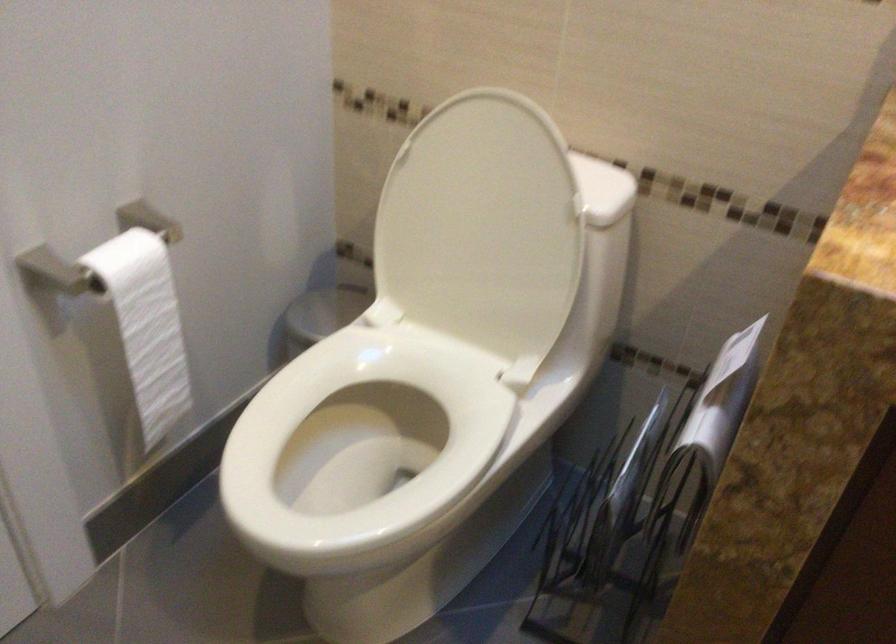
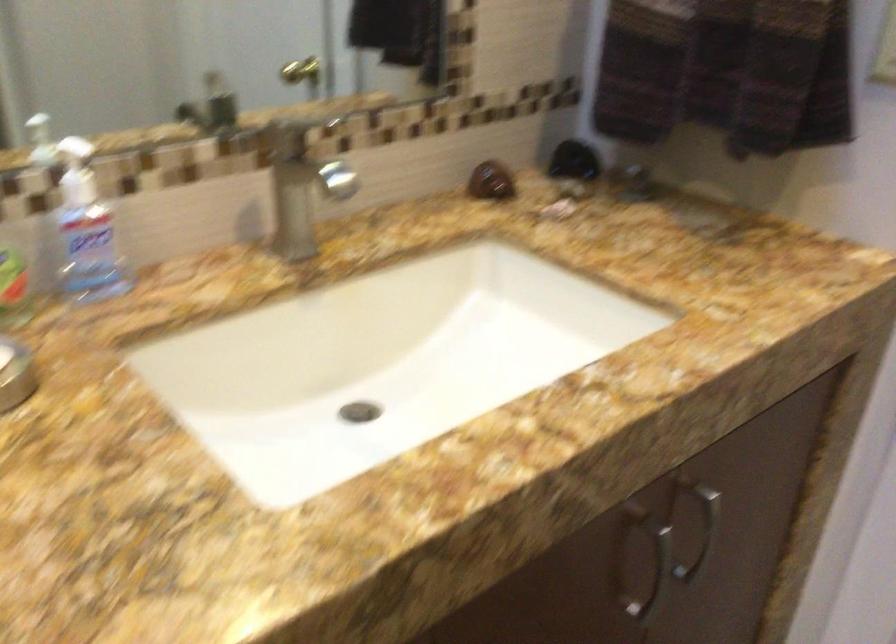
How did the camera likely rotate?

The camera's rotation is toward right-down.